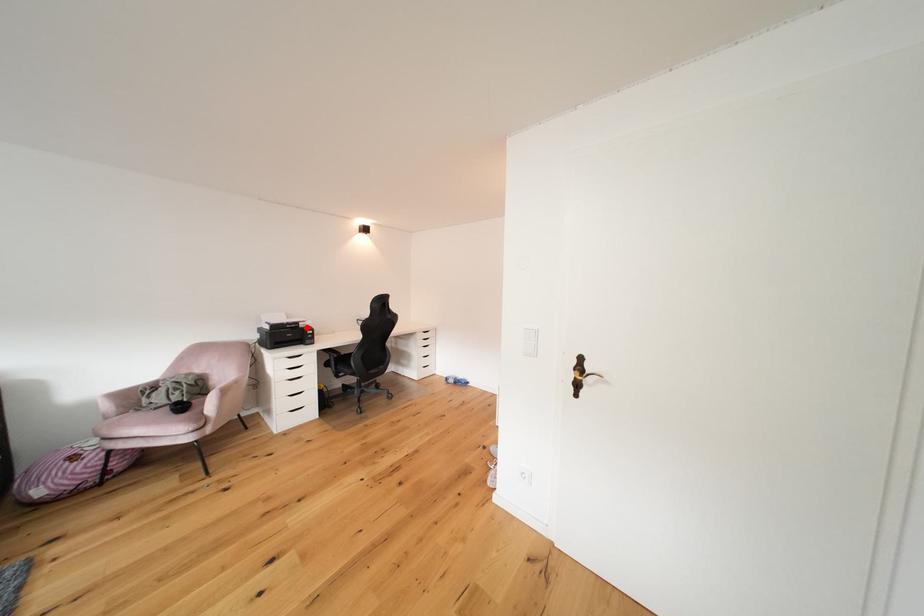
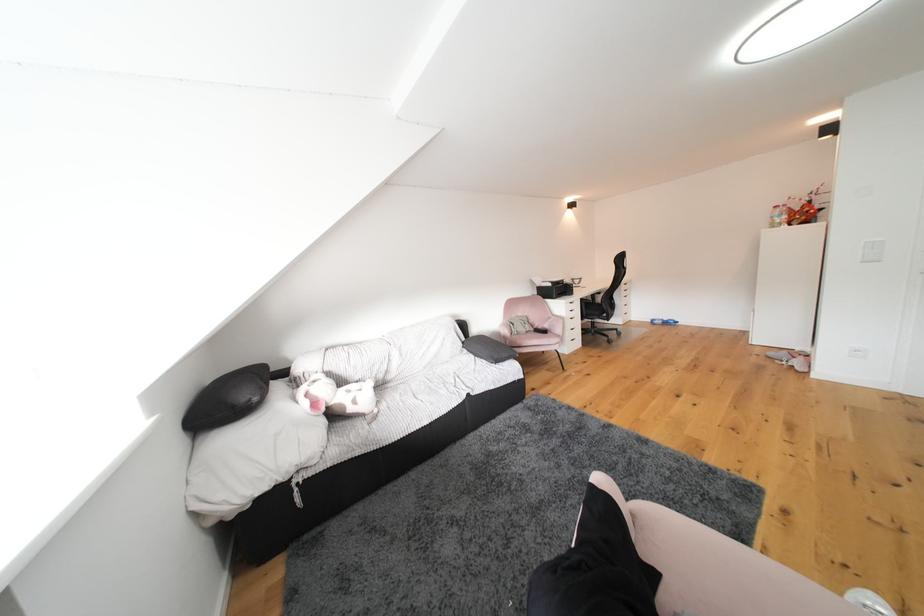
Question: I am providing you with two images of the same scene from different viewpoints. A red point is shown in image1. For the corresponding object point in image2, is it positioned nearer or farther from the camera?

Choices:
 (A) Nearer
 (B) Farther

Answer: (B)